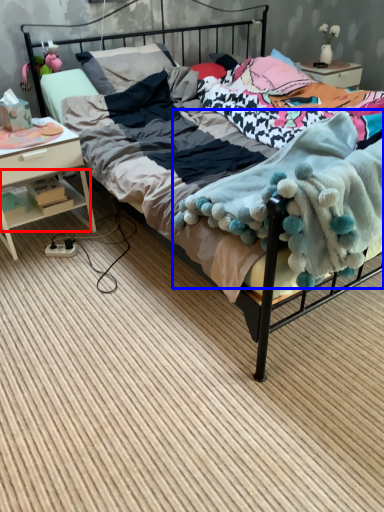
Question: Which object appears farthest to the camera in this image, shelf (highlighted by a red box) or blanket (highlighted by a blue box)?

Choices:
 (A) shelf
 (B) blanket

Answer: (A)